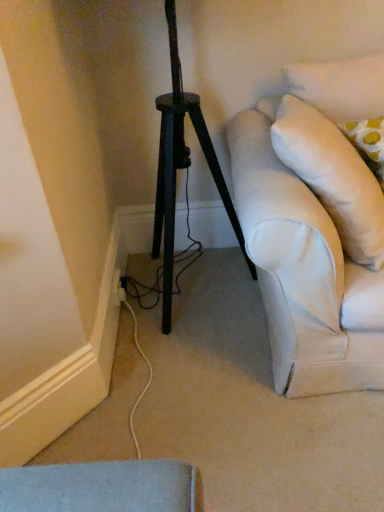
From the picture: What is the approximate height of white plastic electric outlet at lower left?

white plastic electric outlet at lower left is 3.24 inches in height.

The height and width of the screenshot is (512, 384). What do you see at coordinates (118, 289) in the screenshot?
I see `white plastic electric outlet at lower left` at bounding box center [118, 289].

The height and width of the screenshot is (512, 384). Identify the location of white plastic electric outlet at lower left. (118, 289).

Measure the distance between point (366, 243) and camera.

Point (366, 243) and camera are 3.88 feet apart from each other.

What do you see at coordinates (333, 177) in the screenshot? The height and width of the screenshot is (512, 384). I see `white soft pillow at right` at bounding box center [333, 177].

The height and width of the screenshot is (512, 384). Identify the location of white soft pillow at right. (333, 177).

Where is `white plastic electric outlet at lower left`? This screenshot has width=384, height=512. white plastic electric outlet at lower left is located at coordinates (118, 289).

Is white plastic electric outlet at lower left at the left side of white soft pillow at right?

Yes.

Is white plastic electric outlet at lower left in front of or behind white soft pillow at right in the image?

Clearly, white plastic electric outlet at lower left is behind white soft pillow at right.

Is point (116, 274) closer to camera compared to point (288, 161)?

No.

From the image's perspective, is white plastic electric outlet at lower left above white soft pillow at right?

No, from the image's perspective, white plastic electric outlet at lower left is not on top of white soft pillow at right.

Based on the photo, from a real-world perspective, who is located lower, white plastic electric outlet at lower left or white soft pillow at right?

white plastic electric outlet at lower left.

Considering the sizes of white plastic electric outlet at lower left and white soft pillow at right in the image, is white plastic electric outlet at lower left wider or thinner than white soft pillow at right?

white plastic electric outlet at lower left is thinner than white soft pillow at right.

Considering the sizes of objects white plastic electric outlet at lower left and white soft pillow at right in the image provided, who is shorter, white plastic electric outlet at lower left or white soft pillow at right?

Standing shorter between the two is white plastic electric outlet at lower left.

Between white plastic electric outlet at lower left and white soft pillow at right, which one has larger size?

white soft pillow at right is bigger.

Is white plastic electric outlet at lower left surrounding white soft pillow at right?

No, white soft pillow at right is not inside white plastic electric outlet at lower left.

Does white plastic electric outlet at lower left touch white soft pillow at right?

white plastic electric outlet at lower left and white soft pillow at right are clearly separated.

Could you tell me if white plastic electric outlet at lower left is facing white soft pillow at right?

No, white plastic electric outlet at lower left is not aimed at white soft pillow at right.

How many degrees apart are the facing directions of white plastic electric outlet at lower left and white soft pillow at right?

The angular difference between white plastic electric outlet at lower left and white soft pillow at right is 45 degrees.

You are a GUI agent. You are given a task and a screenshot of the screen. Output one action in this format:
    pyautogui.click(x=<x>, y=<y>)
    Task: Click on the pillow on the right of white plastic electric outlet at lower left
    The image size is (384, 512).
    Given the screenshot: What is the action you would take?
    pyautogui.click(x=333, y=177)

Considering the relative positions of white soft pillow at right and white plastic electric outlet at lower left in the image provided, is white soft pillow at right to the left of white plastic electric outlet at lower left from the viewer's perspective?

No.

Is the position of white soft pillow at right more distant than that of white plastic electric outlet at lower left?

No, it is in front of white plastic electric outlet at lower left.

Which is in front, point (382, 262) or point (125, 293)?

The point (382, 262) is closer to the camera.

From the image's perspective, is white soft pillow at right on white plastic electric outlet at lower left?

Yes, from the image's perspective, white soft pillow at right is over white plastic electric outlet at lower left.

From a real-world perspective, is white soft pillow at right on top of white plastic electric outlet at lower left?

Yes, from a real-world perspective, white soft pillow at right is on top of white plastic electric outlet at lower left.

Does white soft pillow at right have a greater width compared to white plastic electric outlet at lower left?

Indeed, white soft pillow at right has a greater width compared to white plastic electric outlet at lower left.

Does white soft pillow at right have a lesser height compared to white plastic electric outlet at lower left?

Incorrect, the height of white soft pillow at right does not fall short of that of white plastic electric outlet at lower left.

Considering the sizes of white soft pillow at right and white plastic electric outlet at lower left in the image, is white soft pillow at right bigger or smaller than white plastic electric outlet at lower left?

Considering their sizes, white soft pillow at right takes up more space than white plastic electric outlet at lower left.

Is white soft pillow at right not inside white plastic electric outlet at lower left?

Indeed, white soft pillow at right is completely outside white plastic electric outlet at lower left.

Is there a large distance between white soft pillow at right and white plastic electric outlet at lower left?

No.

Could you tell me if white soft pillow at right is turned towards white plastic electric outlet at lower left?

No.

What's the angular difference between white soft pillow at right and white plastic electric outlet at lower left's facing directions?

white soft pillow at right and white plastic electric outlet at lower left are facing 45 degrees away from each other.

Find the location of a particular element. The height and width of the screenshot is (512, 384). electric outlet beneath the white soft pillow at right (from a real-world perspective) is located at coordinates (118, 289).

The height and width of the screenshot is (512, 384). I want to click on electric outlet on the left of white soft pillow at right, so click(118, 289).

Identify the location of electric outlet below the white soft pillow at right (from the image's perspective). (118, 289).